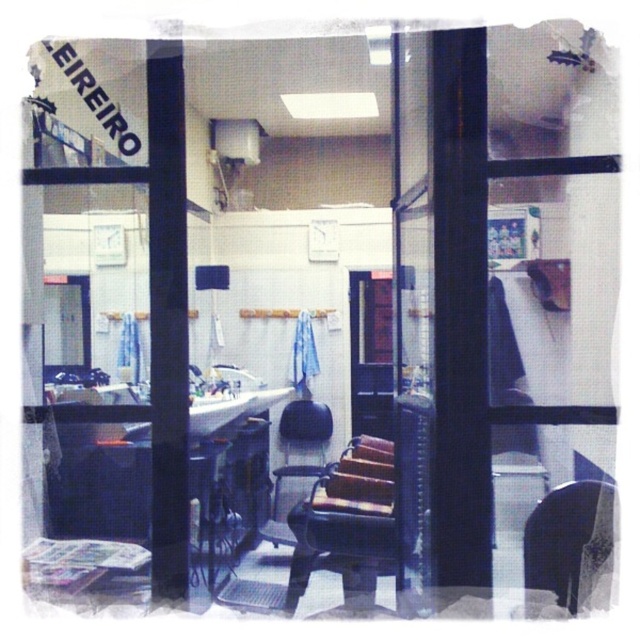
Who is more distant from viewer, (573, 545) or (317, 474)?

Point (317, 474)

Describe the element at coordinates (570, 540) in the screenshot. I see `black leather chair at lower right` at that location.

Find the location of `black leather chair at lower right`. black leather chair at lower right is located at coordinates (570, 540).

Can you confirm if metallic black chair at center is positioned above black leather chair at center?

No, metallic black chair at center is not above black leather chair at center.

Who is positioned more to the left, metallic black chair at center or black leather chair at center?

From the viewer's perspective, black leather chair at center appears more on the left side.

Identify the location of metallic black chair at center. The height and width of the screenshot is (640, 640). (348, 524).

You are a GUI agent. You are given a task and a screenshot of the screen. Output one action in this format:
    pyautogui.click(x=<x>, y=<y>)
    Task: Click on the metallic black chair at center
    
    Given the screenshot: What is the action you would take?
    pyautogui.click(x=348, y=524)

Does metallic black chair at center have a greater height compared to black leather chair at lower right?

Indeed, metallic black chair at center has a greater height compared to black leather chair at lower right.

Between metallic black chair at center and black leather chair at lower right, which one appears on the left side from the viewer's perspective?

metallic black chair at center

Describe the element at coordinates (348, 524) in the screenshot. I see `metallic black chair at center` at that location.

Where is `metallic black chair at center`? Image resolution: width=640 pixels, height=640 pixels. metallic black chair at center is located at coordinates (348, 524).